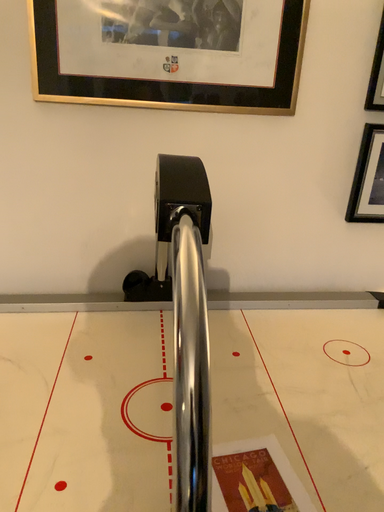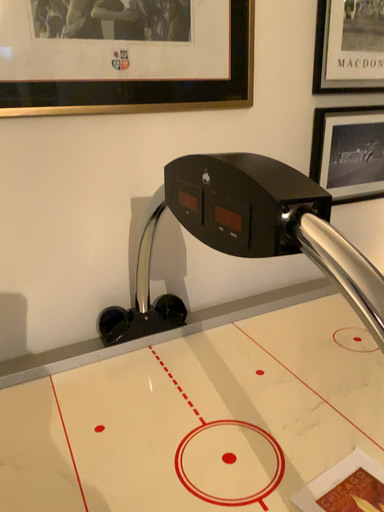
Question: Which way did the camera rotate in the video?

Choices:
 (A) rotated left
 (B) rotated right

Answer: (B)